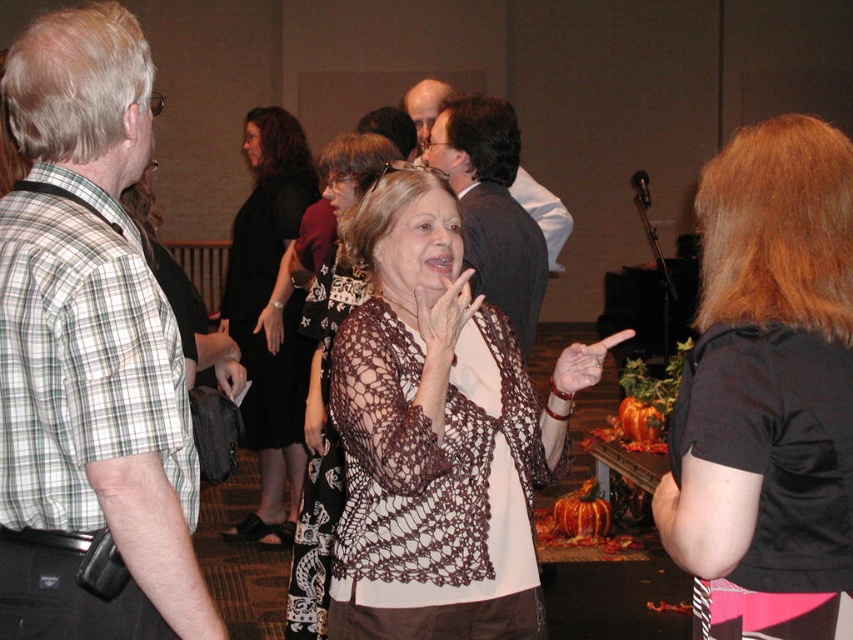
You are an artist sketching the scene and notice two hands at the center of your drawing. The first hand is described as a white lace hand at center, and the second is a matte brown hand at center. Which hand takes up more space in the drawing?

The matte brown hand at center takes up more space than the white lace hand at center because the white lace hand at center occupies less space according to the description.

You are attending the event and notice the black lace shawl at center and the white lace hand at center. Which object is closer to you from your perspective?

The black lace shawl at center is closer to you because the white lace hand at center is behind it.